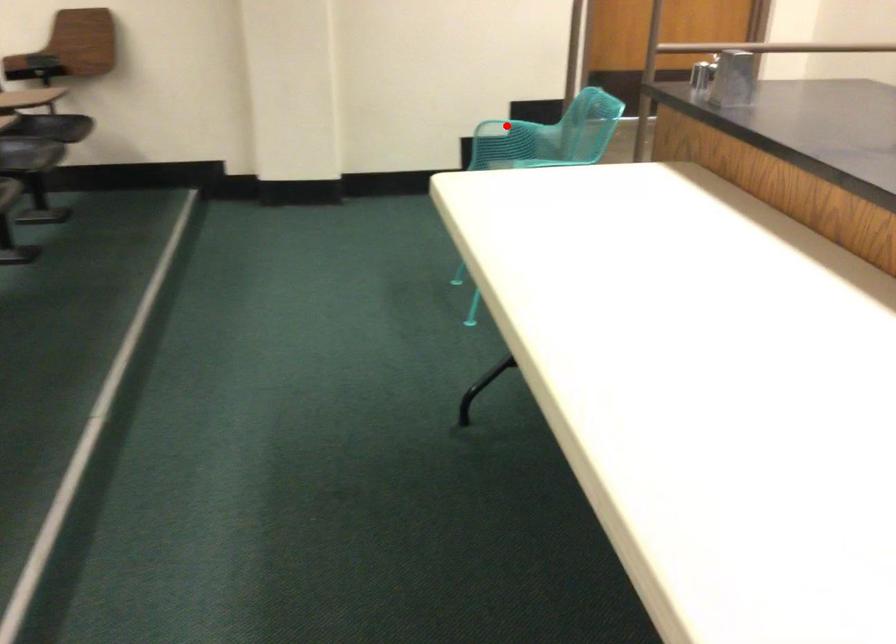
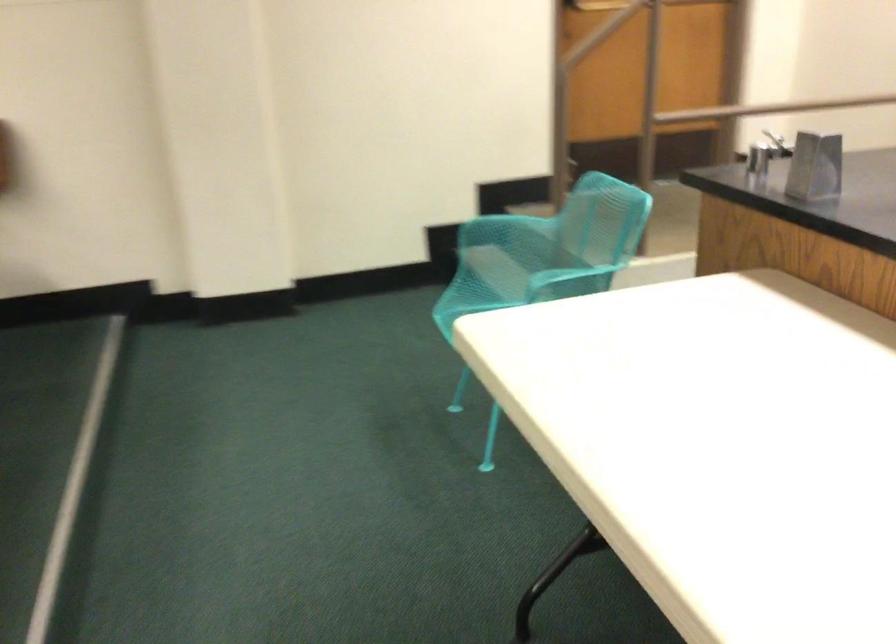
Question: I am providing you with two images of the same scene from different viewpoints. Given a red point in image1, look at the same physical point in image2. Is it:

Choices:
 (A) Closer to the viewpoint
 (B) Farther from the viewpoint

Answer: (A)